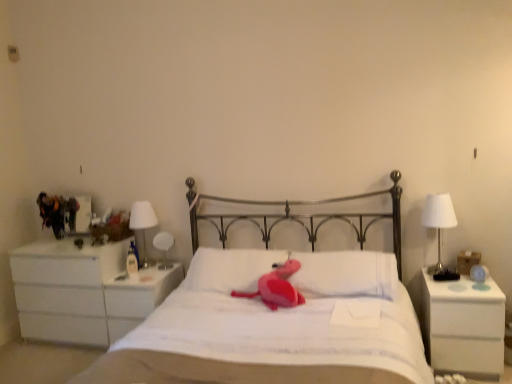
Question: From the image's perspective, would you say matte pink plush at center is shown under white soft pillow at center, positioned as the 1th pillow in left-to-right order?

Choices:
 (A) no
 (B) yes

Answer: (B)

Question: Is the position of matte pink plush at center less distant than that of white soft pillow at center, placed as the 2th pillow when sorted from right to left?

Choices:
 (A) no
 (B) yes

Answer: (B)

Question: Does matte pink plush at center have a larger size compared to white soft pillow at center, placed as the 2th pillow when sorted from right to left?

Choices:
 (A) yes
 (B) no

Answer: (B)

Question: Does matte pink plush at center contain white soft pillow at center, placed as the 2th pillow when sorted from right to left?

Choices:
 (A) no
 (B) yes

Answer: (A)

Question: Considering the relative sizes of matte pink plush at center and white soft pillow at center, positioned as the 1th pillow in left-to-right order, in the image provided, is matte pink plush at center thinner than white soft pillow at center, positioned as the 1th pillow in left-to-right order,?

Choices:
 (A) no
 (B) yes

Answer: (A)

Question: Based on their positions, is white matte chest of drawers at left located to the left or right of white matte bed at center?

Choices:
 (A) left
 (B) right

Answer: (A)

Question: Based on their sizes in the image, would you say white matte chest of drawers at left is bigger or smaller than white matte bed at center?

Choices:
 (A) big
 (B) small

Answer: (B)

Question: From a real-world perspective, is white matte chest of drawers at left above or below white matte bed at center?

Choices:
 (A) above
 (B) below

Answer: (B)

Question: From their relative heights in the image, would you say white matte chest of drawers at left is taller or shorter than white matte bed at center?

Choices:
 (A) tall
 (B) short

Answer: (B)

Question: Relative to white matte bed at center, is white soft pillow at center, which is the first pillow in right-to-left order, in front or behind?

Choices:
 (A) behind
 (B) front

Answer: (A)

Question: Would you say white soft pillow at center, which is the 2th pillow in left-to-right order, is to the left or to the right of white matte bed at center in the picture?

Choices:
 (A) left
 (B) right

Answer: (B)

Question: In terms of size, does white soft pillow at center, which is the first pillow in right-to-left order, appear bigger or smaller than white matte bed at center?

Choices:
 (A) small
 (B) big

Answer: (A)

Question: From the image's perspective, is white soft pillow at center, which is the first pillow in right-to-left order, positioned above or below white matte bed at center?

Choices:
 (A) below
 (B) above

Answer: (B)

Question: Considering the positions of white glossy bedside lamp at left, the 1th bedside lamp viewed from the left, and white soft pillow at center, positioned as the 1th pillow in left-to-right order, in the image, is white glossy bedside lamp at left, the 1th bedside lamp viewed from the left, wider or thinner than white soft pillow at center, positioned as the 1th pillow in left-to-right order,?

Choices:
 (A) wide
 (B) thin

Answer: (B)

Question: Is white glossy bedside lamp at left, the 1th bedside lamp viewed from the left, inside or outside of white soft pillow at center, positioned as the 1th pillow in left-to-right order?

Choices:
 (A) outside
 (B) inside

Answer: (A)